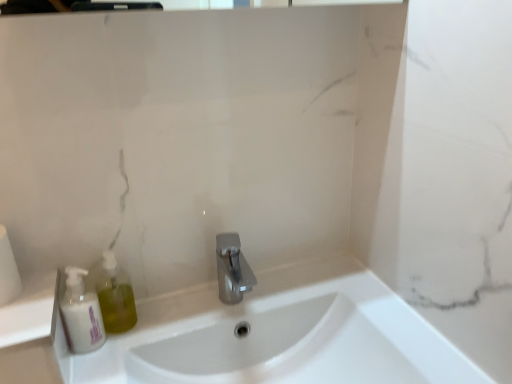
Where is `free point to the right of white matte bottle at left`? The height and width of the screenshot is (384, 512). free point to the right of white matte bottle at left is located at coordinates (155, 321).